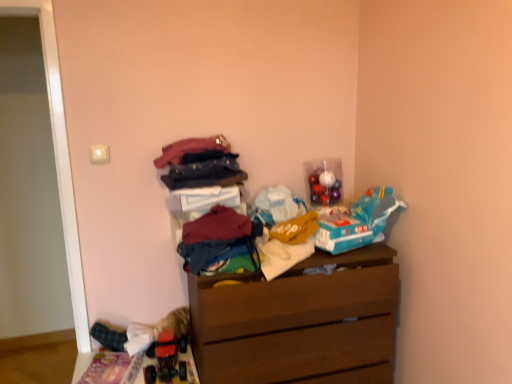
Question: Can you confirm if brown wooden chest of drawers at center is thinner than rubberized plastic toy car at lower left, the 2th toy viewed from the back?

Choices:
 (A) yes
 (B) no

Answer: (B)

Question: From a real-world perspective, is brown wooden chest of drawers at center below rubberized plastic toy car at lower left, the second toy positioned from the right?

Choices:
 (A) no
 (B) yes

Answer: (B)

Question: From a real-world perspective, is brown wooden chest of drawers at center positioned over rubberized plastic toy car at lower left, the 2th toy viewed from the back, based on gravity?

Choices:
 (A) no
 (B) yes

Answer: (A)

Question: Does brown wooden chest of drawers at center have a greater height compared to rubberized plastic toy car at lower left, acting as the first toy starting from the bottom?

Choices:
 (A) no
 (B) yes

Answer: (B)

Question: Is brown wooden chest of drawers at center to the right of rubberized plastic toy car at lower left, the first toy positioned from the left, from the viewer's perspective?

Choices:
 (A) yes
 (B) no

Answer: (A)

Question: From the image's perspective, is brown wooden chest of drawers at center on top of rubberized plastic toy car at lower left, the first toy positioned from the left?

Choices:
 (A) no
 (B) yes

Answer: (B)

Question: From a real-world perspective, does matte pink fabric at upper center, marked as the first clothing in a top-to-bottom arrangement, stand above brown wooden chest of drawers at center?

Choices:
 (A) yes
 (B) no

Answer: (A)

Question: From a real-world perspective, does matte pink fabric at upper center, marked as the first clothing in a top-to-bottom arrangement, sit lower than brown wooden chest of drawers at center?

Choices:
 (A) yes
 (B) no

Answer: (B)

Question: Considering the relative sizes of matte pink fabric at upper center, marked as the first clothing in a top-to-bottom arrangement, and brown wooden chest of drawers at center in the image provided, is matte pink fabric at upper center, marked as the first clothing in a top-to-bottom arrangement, shorter than brown wooden chest of drawers at center?

Choices:
 (A) no
 (B) yes

Answer: (B)

Question: Does matte pink fabric at upper center, marked as the first clothing in a top-to-bottom arrangement, have a larger size compared to brown wooden chest of drawers at center?

Choices:
 (A) no
 (B) yes

Answer: (A)

Question: Can you confirm if matte pink fabric at upper center, marked as the third clothing in a bottom-to-top arrangement, is positioned to the right of brown wooden chest of drawers at center?

Choices:
 (A) no
 (B) yes

Answer: (A)

Question: Are matte pink fabric at upper center, marked as the third clothing in a bottom-to-top arrangement, and brown wooden chest of drawers at center located far from each other?

Choices:
 (A) yes
 (B) no

Answer: (B)

Question: Is the depth of shiny metallic ornaments at upper right, the second toy positioned from the left, less than that of matte pink fabric at upper center, marked as the first clothing in a top-to-bottom arrangement?

Choices:
 (A) no
 (B) yes

Answer: (A)